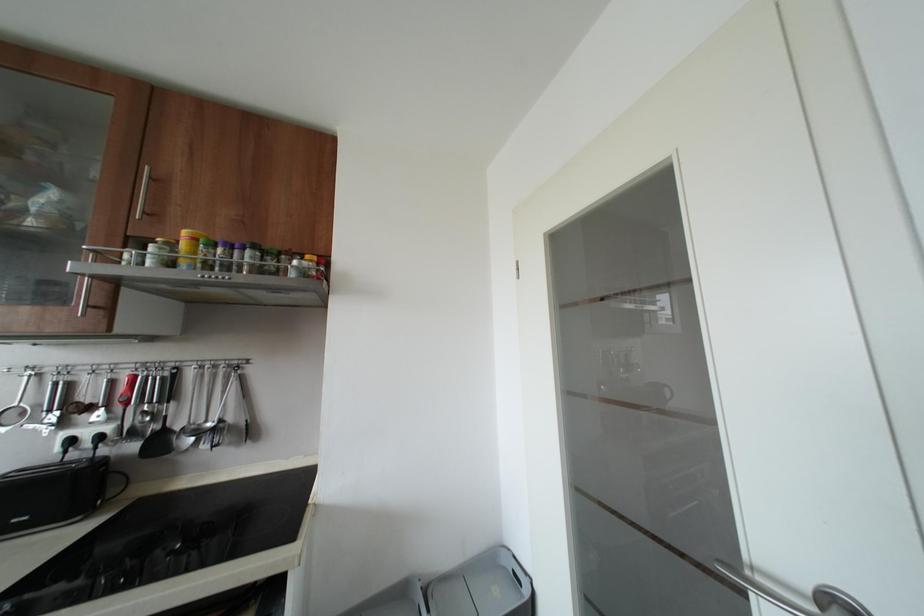
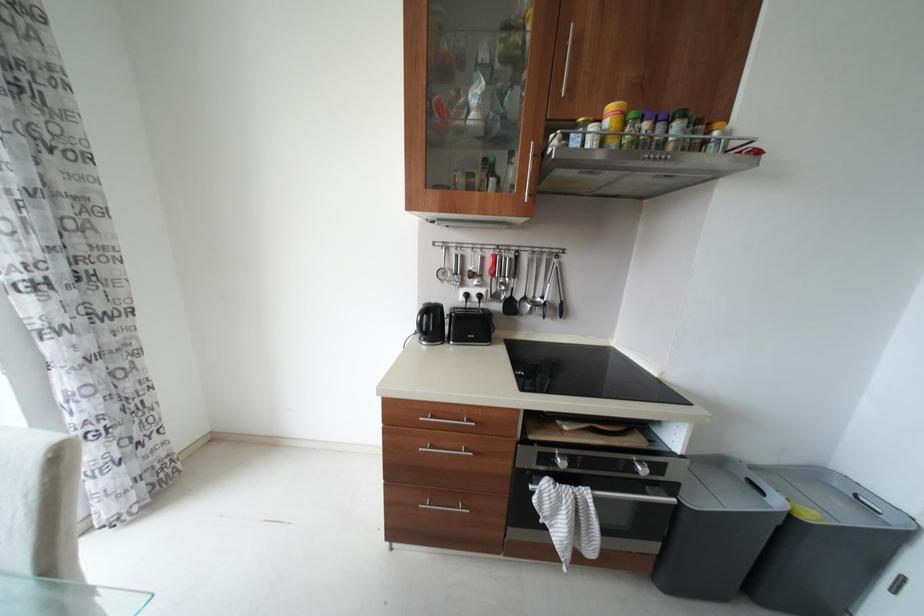
How did the camera likely rotate?

The camera rotated toward left-down.